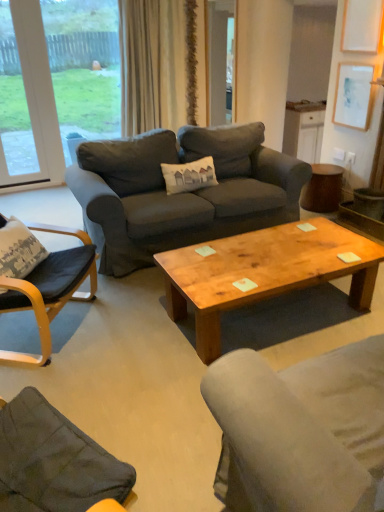
Where is `free space above wooden coffee table at center (from a real-world perspective)`? free space above wooden coffee table at center (from a real-world perspective) is located at coordinates (276, 253).